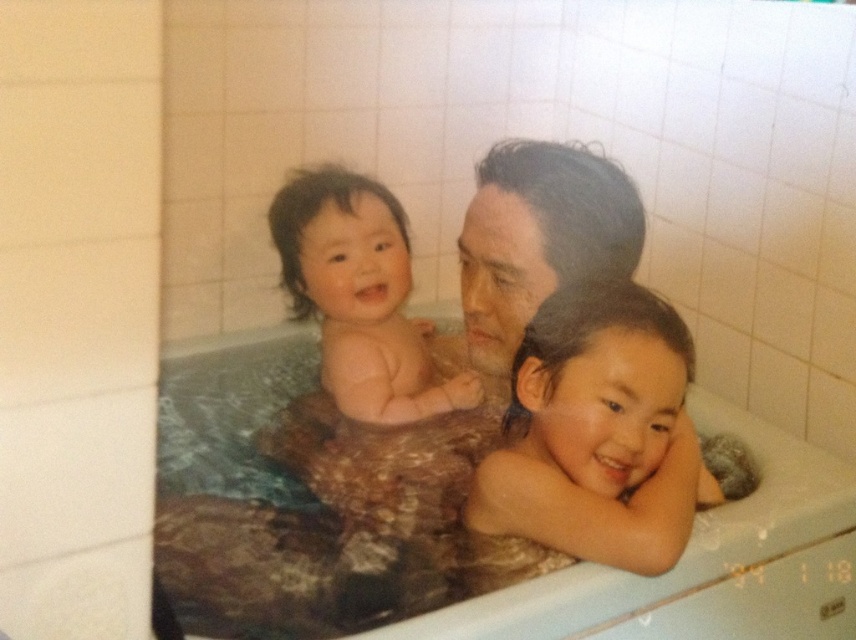
You are a parent trying to hand a washcloth to the smooth skin child at center and the brown textured fabric at center. Can you reach both objects at the same time if your arms can extend 8 inches?

The smooth skin child at center and the brown textured fabric at center are 8.24 inches apart. Since your arms can only extend 8 inches, you cannot reach both at the same time.

You are a photographer taking a closeup shot of the smooth skin child at center in the bathtub scene. Your camera is focused on point (598, 433). Based on the scene description, is this point likely on the smooth skin child at center?

Yes, the point (598, 433) is on the smooth skin child at center, so the camera is focused on the correct subject.